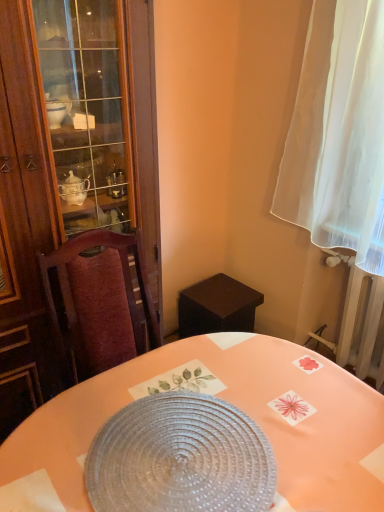
This screenshot has width=384, height=512. What are the coordinates of `free point above clear plastic placemat at center (from a real-world perspective)` in the screenshot? It's located at (182, 450).